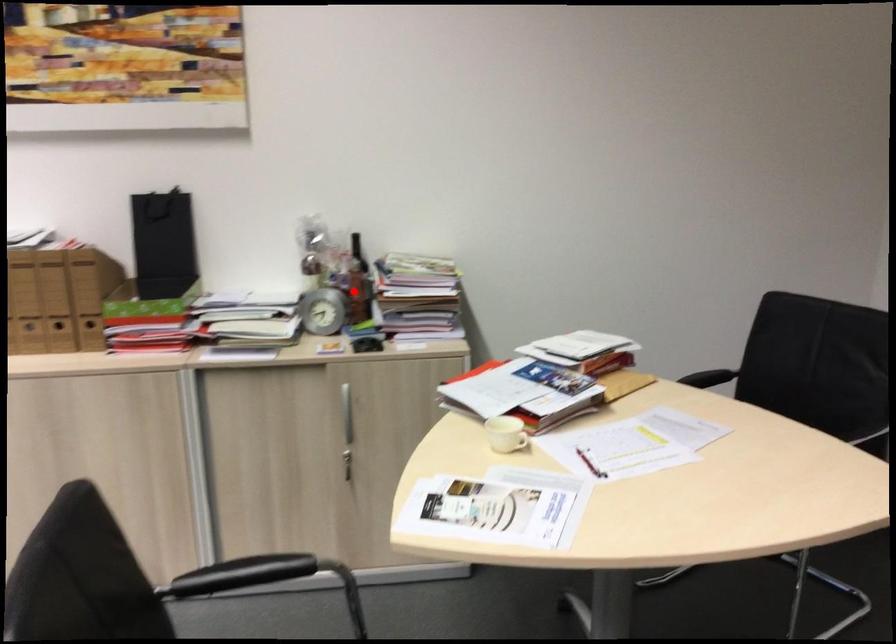
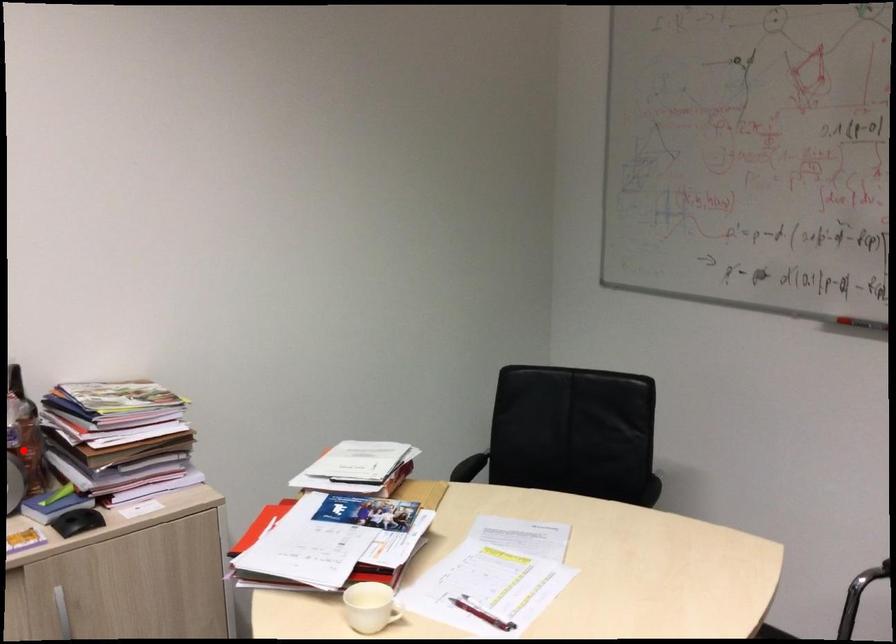
I am providing you with two images of the same scene from different viewpoints. A red point is marked on the first image and another point is marked on the second image. Does the point marked in image1 correspond to the same location as the one in image2?

Yes